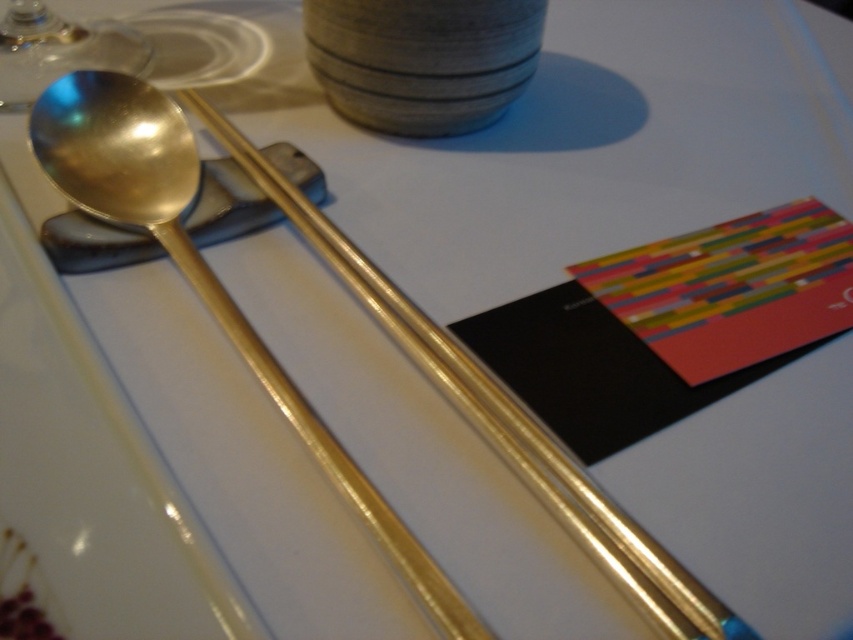
From the picture: You are a server in a restaurant and need to locate the gold shiny spoon at upper left. What are its coordinates?

The gold shiny spoon at upper left is located at coordinates point (x=204, y=273).

You are a server at a restaurant and need to hand a customer the transparent glass at upper left. Can you easily reach it without moving the gold shiny spoon at upper left?

The gold shiny spoon at upper left is in front of the transparent glass at upper left, so you cannot easily reach the transparent glass at upper left without moving the gold shiny spoon at upper left first.

You are a server at a restaurant and need to place a napkin on the table. You see the gold shiny spoon at upper left and the transparent glass at upper left. Which object should you place the napkin under to ensure it doesn not slip off?

The transparent glass at upper left should be placed under the napkin because the gold shiny spoon at upper left is positioned on its right side, making the glass more stable for holding the napkin.